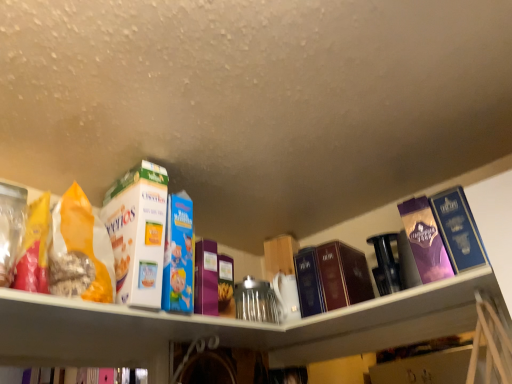
What is the approximate height of purple glossy book at upper right, marked as the 1th book in a right-to-left arrangement?

It is 23.64 centimeters.

Describe the element at coordinates (178, 255) in the screenshot. I see `blue cardboard cereal box at center, marked as the sixth book in a right-to-left arrangement` at that location.

The image size is (512, 384). Identify the location of white cardboard cereal box at upper left, the second book when ordered from left to right. (138, 233).

In order to face matte orange bag of cereal at left, should I rotate leftwards or rightwards?

To face it directly, rotate left by 20.627 degrees.

The height and width of the screenshot is (384, 512). Find the location of `matte orange bag of cereal at left`. matte orange bag of cereal at left is located at coordinates (83, 244).

This screenshot has width=512, height=384. Identify the location of dark blue hardcover book at center, arranged as the sixth book when viewed from the left. (331, 277).

You are a GUI agent. You are given a task and a screenshot of the screen. Output one action in this format:
    pyautogui.click(x=<x>, y=<y>)
    Task: Click on the purple glossy book at upper right, the 8th book from the left
    This screenshot has width=512, height=384.
    Given the screenshot: What is the action you would take?
    pyautogui.click(x=458, y=230)

How far apart are purple glossy book at upper right, which appears as the second book when viewed from the right, and clear plastic jar at left, the 1th book from the left?

purple glossy book at upper right, which appears as the second book when viewed from the right, is 37.60 inches from clear plastic jar at left, the 1th book from the left.

From the image's perspective, would you say purple glossy book at upper right, which appears as the second book when viewed from the right, is positioned over clear plastic jar at left, the 1th book from the left?

Incorrect, from the image's perspective, purple glossy book at upper right, which appears as the second book when viewed from the right, is lower than clear plastic jar at left, the 1th book from the left.

Is purple glossy book at upper right, which appears as the seventh book when viewed from the left, shorter than clear plastic jar at left, the 1th book from the left?

No, purple glossy book at upper right, which appears as the seventh book when viewed from the left, is not shorter than clear plastic jar at left, the 1th book from the left.

Based on the photo, is purple glossy book at upper right, which appears as the seventh book when viewed from the left, not close to clear plastic jar at left, which appears as the 8th book when viewed from the right?

purple glossy book at upper right, which appears as the seventh book when viewed from the left, is actually quite close to clear plastic jar at left, which appears as the 8th book when viewed from the right.

Is clear plastic jar at left, the 1th book from the left, facing towards purple glossy book at upper right, marked as the 1th book in a right-to-left arrangement?

No, clear plastic jar at left, the 1th book from the left, is not facing towards purple glossy book at upper right, marked as the 1th book in a right-to-left arrangement.

Considering the sizes of objects clear plastic jar at left, which appears as the 8th book when viewed from the right, and purple glossy book at upper right, marked as the 1th book in a right-to-left arrangement, in the image provided, who is bigger, clear plastic jar at left, which appears as the 8th book when viewed from the right, or purple glossy book at upper right, marked as the 1th book in a right-to-left arrangement,?

Bigger between the two is clear plastic jar at left, which appears as the 8th book when viewed from the right.

Where is `the 2nd book below the clear plastic jar at left, which appears as the 8th book when viewed from the right (from a real-world perspective)`? the 2nd book below the clear plastic jar at left, which appears as the 8th book when viewed from the right (from a real-world perspective) is located at coordinates (458, 230).

Can you tell me how much white cardboard cereal box at upper left, which is the 7th book in right-to-left order, and blue cardboard cereal box at center, marked as the sixth book in a right-to-left arrangement, differ in facing direction?

4.86 degrees.

This screenshot has height=384, width=512. I want to click on the 1st book to the left of the blue cardboard cereal box at center, marked as the sixth book in a right-to-left arrangement, counting from the anchor's position, so click(138, 233).

Based on the photo, from the image's perspective, would you say white cardboard cereal box at upper left, the second book when ordered from left to right, is positioned over blue cardboard cereal box at center, which is the 3th book from left to right?

Yes, from the image's perspective, white cardboard cereal box at upper left, the second book when ordered from left to right, is on top of blue cardboard cereal box at center, which is the 3th book from left to right.

Is purple cardboard book at center, the 5th book from the right, beside clear plastic jar at left, the 1th book from the left?

purple cardboard book at center, the 5th book from the right, and clear plastic jar at left, the 1th book from the left, are not in contact.

Would you say purple cardboard book at center, the 4th book positioned from the left, is inside or outside clear plastic jar at left, the 1th book from the left?

purple cardboard book at center, the 4th book positioned from the left, cannot be found inside clear plastic jar at left, the 1th book from the left.

Can you tell me how much purple cardboard book at center, the 5th book from the right, and clear plastic jar at left, which appears as the 8th book when viewed from the right, differ in facing direction?

There is a 2.62-degree angle between the facing directions of purple cardboard book at center, the 5th book from the right, and clear plastic jar at left, which appears as the 8th book when viewed from the right.

From the image's perspective, which one is positioned lower, purple cardboard book at center, the 4th book positioned from the left, or clear plastic jar at left, the 1th book from the left?

purple cardboard book at center, the 4th book positioned from the left.

Looking at this image, looking at the image, does purple glossy book at upper right, which appears as the seventh book when viewed from the left, seem bigger or smaller compared to white cardboard cereal box at upper left, the second book when ordered from left to right?

purple glossy book at upper right, which appears as the seventh book when viewed from the left, is smaller than white cardboard cereal box at upper left, the second book when ordered from left to right.

From the image's perspective, who appears lower, purple glossy book at upper right, which appears as the seventh book when viewed from the left, or white cardboard cereal box at upper left, the second book when ordered from left to right?

purple glossy book at upper right, which appears as the seventh book when viewed from the left, is shown below in the image.

Starting from the white cardboard cereal box at upper left, which is the 7th book in right-to-left order, which book is the 5th one to the right? Please provide its 2D coordinates.

[(425, 240)]

Could you tell me if purple glossy book at upper right, which appears as the second book when viewed from the right, is facing white cardboard cereal box at upper left, which is the 7th book in right-to-left order?

No, purple glossy book at upper right, which appears as the second book when viewed from the right, is not turned towards white cardboard cereal box at upper left, which is the 7th book in right-to-left order.

Is purple glossy book at upper right, which appears as the seventh book when viewed from the left, directly adjacent to hardcover book at center, which is counted as the 5th book, starting from the left?

No, purple glossy book at upper right, which appears as the seventh book when viewed from the left, is not next to hardcover book at center, which is counted as the 5th book, starting from the left.

Considering the positions of points (434, 251) and (305, 289), is point (434, 251) closer to camera compared to point (305, 289)?

Yes, it is in front of point (305, 289).

From a real-world perspective, is purple glossy book at upper right, which appears as the seventh book when viewed from the left, above or below hardcover book at center, placed as the fourth book when sorted from right to left?

From a real-world perspective, purple glossy book at upper right, which appears as the seventh book when viewed from the left, is physically above hardcover book at center, placed as the fourth book when sorted from right to left.

Between purple glossy book at upper right, which appears as the second book when viewed from the right, and hardcover book at center, placed as the fourth book when sorted from right to left, which one has more height?

With more height is purple glossy book at upper right, which appears as the second book when viewed from the right.

Would you consider purple glossy book at upper right, marked as the 1th book in a right-to-left arrangement, to be distant from blue cardboard cereal box at center, which is the 3th book from left to right?

They are positioned close to each other.

Is purple glossy book at upper right, the 8th book from the left, oriented away from blue cardboard cereal box at center, which is the 3th book from left to right?

No, blue cardboard cereal box at center, which is the 3th book from left to right, is not at the back of purple glossy book at upper right, the 8th book from the left.

Considering the relative sizes of purple glossy book at upper right, marked as the 1th book in a right-to-left arrangement, and blue cardboard cereal box at center, marked as the sixth book in a right-to-left arrangement, in the image provided, is purple glossy book at upper right, marked as the 1th book in a right-to-left arrangement, taller than blue cardboard cereal box at center, marked as the sixth book in a right-to-left arrangement,?

Incorrect, the height of purple glossy book at upper right, marked as the 1th book in a right-to-left arrangement, is not larger of that of blue cardboard cereal box at center, marked as the sixth book in a right-to-left arrangement.

From the image's perspective, relative to blue cardboard cereal box at center, which is the 3th book from left to right, is purple glossy book at upper right, the 8th book from the left, above or below?

Based on their image positions, purple glossy book at upper right, the 8th book from the left, is located above blue cardboard cereal box at center, which is the 3th book from left to right.

Find the location of a particular element. This screenshot has height=384, width=512. book that is the 6th one when counting rightward from the clear plastic jar at left, the 1th book from the left is located at coordinates (425, 240).

In the image, there is a purple glossy book at upper right, marked as the 1th book in a right-to-left arrangement. Identify the location of book above it (from the image's perspective). (11, 227).

From the image, which object appears to be farther from dark blue hardcover book at center, arranged as the sixth book when viewed from the left, blue cardboard cereal box at center, which is the 3th book from left to right, or purple cardboard book at center, the 4th book positioned from the left?

blue cardboard cereal box at center, which is the 3th book from left to right, lies further to dark blue hardcover book at center, arranged as the sixth book when viewed from the left, than the other object.

Based on the photo, when comparing their distances from matte orange bag of cereal at left, does blue cardboard cereal box at center, which is the 3th book from left to right, or purple glossy book at upper right, which appears as the seventh book when viewed from the left, seem closer?

blue cardboard cereal box at center, which is the 3th book from left to right.

Estimate the real-world distances between objects in this image. Which object is closer to clear plastic jar at left, the 1th book from the left, dark blue hardcover book at center, arranged as the sixth book when viewed from the left, or white cardboard cereal box at upper left, which is the 7th book in right-to-left order?

white cardboard cereal box at upper left, which is the 7th book in right-to-left order, is closer to clear plastic jar at left, the 1th book from the left.

Looking at the image, which one is located closer to blue cardboard cereal box at center, marked as the sixth book in a right-to-left arrangement, purple glossy book at upper right, the 8th book from the left, or clear plastic jar at left, the 1th book from the left?

clear plastic jar at left, the 1th book from the left, is positioned closer to the anchor blue cardboard cereal box at center, marked as the sixth book in a right-to-left arrangement.

Estimate the real-world distances between objects in this image. Which object is further from hardcover book at center, which is counted as the 5th book, starting from the left, blue cardboard cereal box at center, which is the 3th book from left to right, or dark blue hardcover book at center, the third book when ordered from right to left?

Based on the image, blue cardboard cereal box at center, which is the 3th book from left to right, appears to be further to hardcover book at center, which is counted as the 5th book, starting from the left.

From the image, which object appears to be farther from matte orange bag of cereal at left, dark blue hardcover book at center, the third book when ordered from right to left, or clear plastic jar at left, which appears as the 8th book when viewed from the right?

dark blue hardcover book at center, the third book when ordered from right to left, lies further to matte orange bag of cereal at left than the other object.

Considering their positions, is white cardboard cereal box at upper left, the second book when ordered from left to right, positioned closer to matte orange bag of cereal at left than purple glossy book at upper right, which appears as the second book when viewed from the right?

white cardboard cereal box at upper left, the second book when ordered from left to right, is positioned closer to the anchor matte orange bag of cereal at left.

When comparing their distances from blue cardboard cereal box at center, marked as the sixth book in a right-to-left arrangement, does clear plastic jar at left, the 1th book from the left, or purple glossy book at upper right, marked as the 1th book in a right-to-left arrangement, seem further?

Based on the image, purple glossy book at upper right, marked as the 1th book in a right-to-left arrangement, appears to be further to blue cardboard cereal box at center, marked as the sixth book in a right-to-left arrangement.

You are a GUI agent. You are given a task and a screenshot of the screen. Output one action in this format:
    pyautogui.click(x=<x>, y=<y>)
    Task: Click on the cereal located between clear plastic jar at left, which appears as the 8th book when viewed from the right, and purple cardboard book at center, the 4th book positioned from the left, in the depth direction
    Image resolution: width=512 pixels, height=384 pixels.
    Given the screenshot: What is the action you would take?
    pyautogui.click(x=83, y=244)

Identify the location of cereal between clear plastic jar at left, which appears as the 8th book when viewed from the right, and blue cardboard cereal box at center, marked as the sixth book in a right-to-left arrangement. The image size is (512, 384). (83, 244).

Where is `book between blue cardboard cereal box at center, which is the 3th book from left to right, and hardcover book at center, which is counted as the 5th book, starting from the left, in the horizontal direction`? book between blue cardboard cereal box at center, which is the 3th book from left to right, and hardcover book at center, which is counted as the 5th book, starting from the left, in the horizontal direction is located at coordinates (206, 278).

Where is `cereal located between clear plastic jar at left, which appears as the 8th book when viewed from the right, and purple glossy book at upper right, the 8th book from the left, in the left-right direction`? cereal located between clear plastic jar at left, which appears as the 8th book when viewed from the right, and purple glossy book at upper right, the 8th book from the left, in the left-right direction is located at coordinates (83, 244).